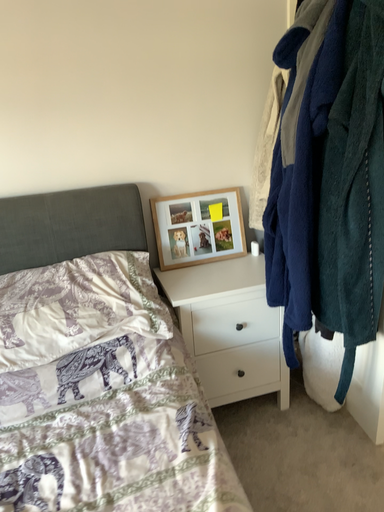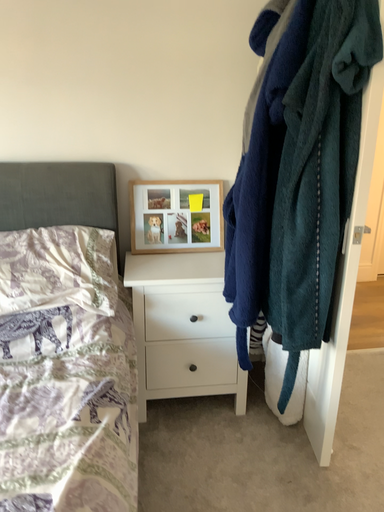
Question: Which way did the camera rotate in the video?

Choices:
 (A) rotated right
 (B) rotated left

Answer: (B)